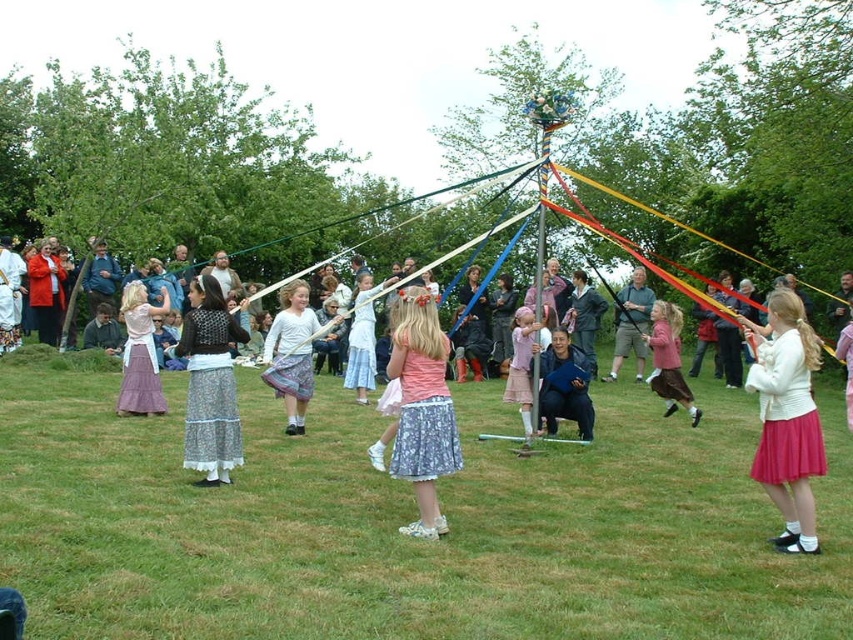
Question: Which point is farther to the camera?

Choices:
 (A) floral-patterned skirt at center
 (B) matte pink skirt at center

Answer: (B)

Question: Can you confirm if green grass at center is smaller than matte pink skirt at right?

Choices:
 (A) no
 (B) yes

Answer: (A)

Question: Which is farther from the matte pink skirt at right?

Choices:
 (A) matte pink skirt at center
 (B) dark blue leather jacket at center

Answer: (A)

Question: Which point appears closest to the camera in this image?

Choices:
 (A) (395, 342)
 (B) (225, 442)

Answer: (A)

Question: Where is dark blue leather jacket at center located in relation to matte gray sweater at center in the image?

Choices:
 (A) above
 (B) below

Answer: (B)

Question: From the image, what is the correct spatial relationship of green grass at center in relation to floral lace skirt at center?

Choices:
 (A) below
 (B) above

Answer: (A)